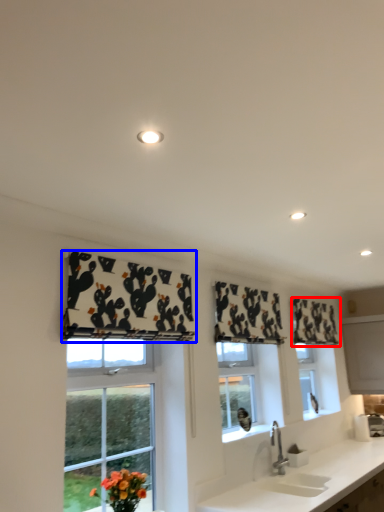
Question: Among these objects, which one is nearest to the camera, curtain (highlighted by a red box) or curtain (highlighted by a blue box)?

Choices:
 (A) curtain
 (B) curtain

Answer: (B)